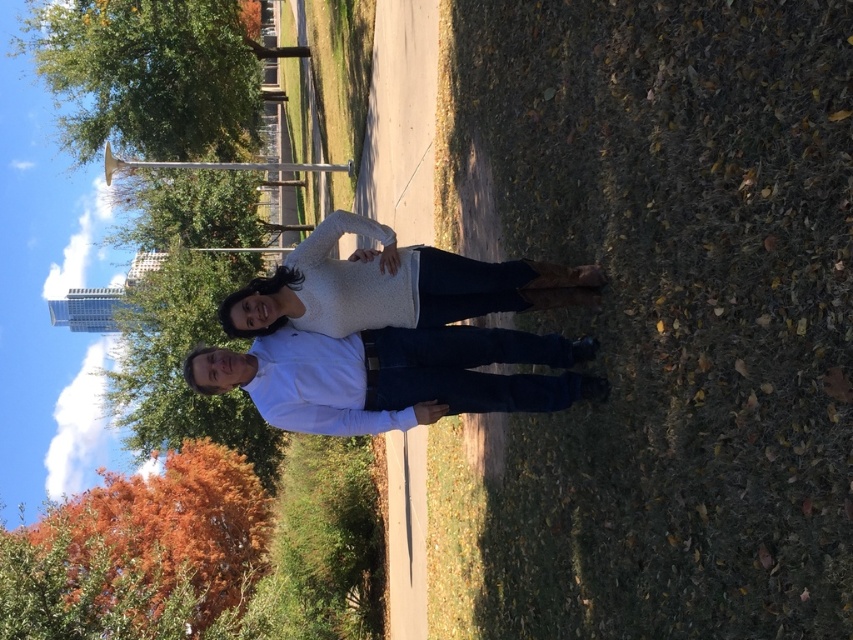
Can you confirm if white cotton shirt at center is positioned to the right of white knit sweater at center?

In fact, white cotton shirt at center is to the left of white knit sweater at center.

Can you confirm if white cotton shirt at center is positioned below white knit sweater at center?

Indeed, white cotton shirt at center is positioned under white knit sweater at center.

I want to click on white cotton shirt at center, so click(392, 376).